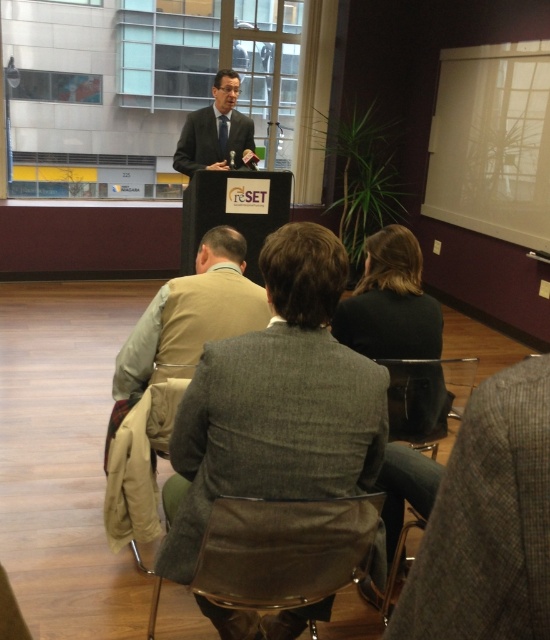
Describe the element at coordinates (277, 401) in the screenshot. The width and height of the screenshot is (550, 640). I see `gray wool blazer at center` at that location.

Is gray wool blazer at center above brown fabric chair at center?

Correct, gray wool blazer at center is located above brown fabric chair at center.

Does point (380, 401) come behind point (310, 538)?

Yes, it is behind point (310, 538).

Image resolution: width=550 pixels, height=640 pixels. What are the coordinates of `gray wool blazer at center` in the screenshot? It's located at (277, 401).

Can you confirm if black fabric jacket at center is bigger than black leather chair at center?

Correct, black fabric jacket at center is larger in size than black leather chair at center.

Based on the photo, who is taller, black fabric jacket at center or black leather chair at center?

black fabric jacket at center is taller.

Locate an element on the screen. This screenshot has width=550, height=640. black fabric jacket at center is located at coordinates (x=390, y=301).

Does point (221, 515) lie in front of point (207, 115)?

Yes, point (221, 515) is in front of point (207, 115).

Between point (309, 545) and point (204, 161), which one is positioned behind?

Point (204, 161)

Locate an element on the screen. This screenshot has width=550, height=640. brown fabric chair at center is located at coordinates (283, 550).